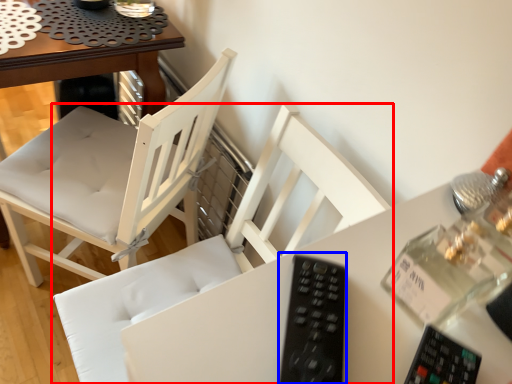
Question: Which object is closer to the camera taking this photo, chair (highlighted by a red box) or remote (highlighted by a blue box)?

Choices:
 (A) chair
 (B) remote

Answer: (B)